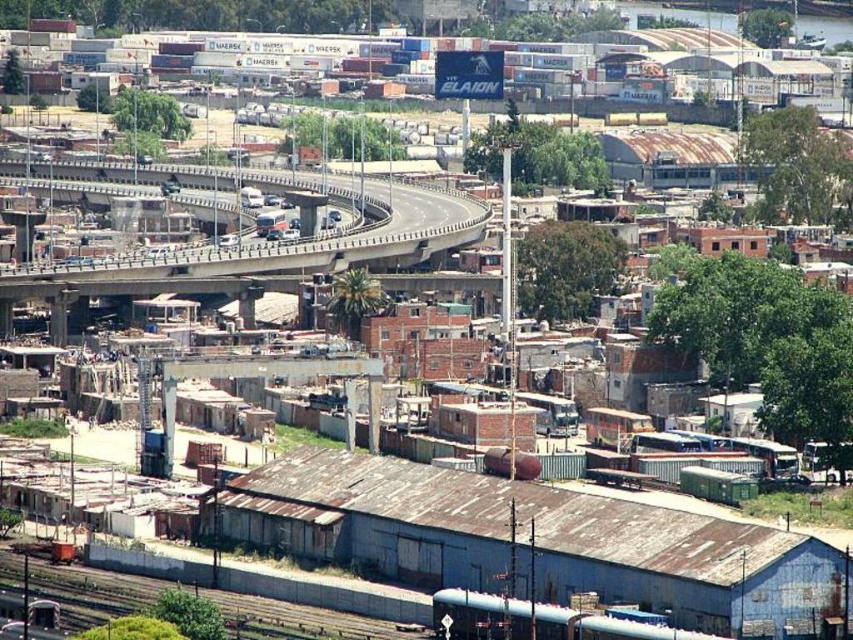
Question: Can you confirm if concrete bridge at upper center is positioned to the right of rusty metal train track at lower left?

Choices:
 (A) no
 (B) yes

Answer: (B)

Question: Is concrete bridge at upper center in front of rusty metal train track at lower left?

Choices:
 (A) yes
 (B) no

Answer: (B)

Question: Which point appears closest to the camera in this image?

Choices:
 (A) (403, 244)
 (B) (54, 580)

Answer: (A)

Question: Considering the relative positions of concrete bridge at upper center and rusty metal train track at lower left in the image provided, where is concrete bridge at upper center located with respect to rusty metal train track at lower left?

Choices:
 (A) below
 (B) above

Answer: (B)

Question: Which point appears farthest from the camera in this image?

Choices:
 (A) (187, 195)
 (B) (90, 612)

Answer: (A)